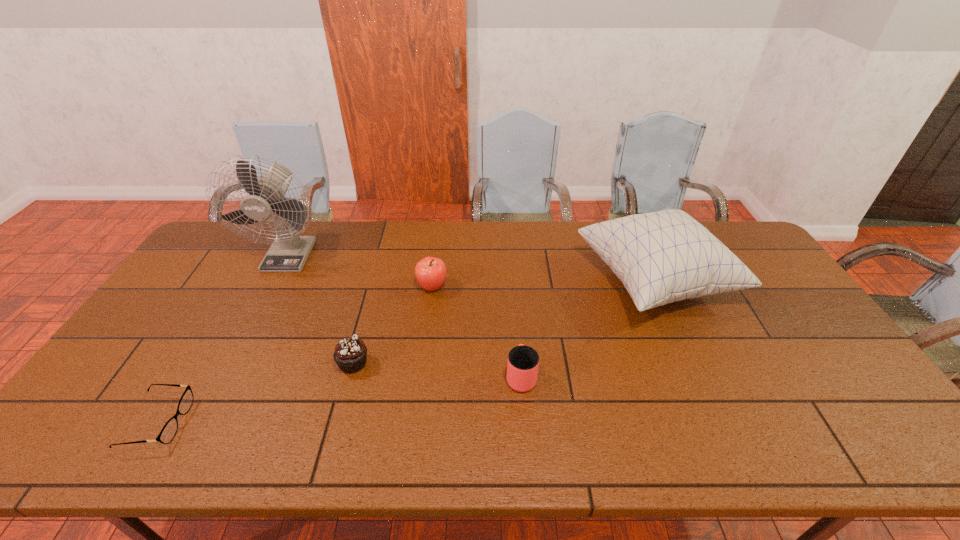
You are a GUI agent. You are given a task and a screenshot of the screen. Output one action in this format:
    pyautogui.click(x=<x>, y=<y>)
    Task: Click on the tallest object
    Image resolution: width=960 pixels, height=540 pixels.
    Given the screenshot: What is the action you would take?
    pyautogui.click(x=289, y=251)

Locate an element on the screen. The width and height of the screenshot is (960, 540). the rightmost object is located at coordinates (661, 257).

Locate an element on the screen. The width and height of the screenshot is (960, 540). cushion is located at coordinates (661, 257).

Find the location of `apple`. apple is located at coordinates (430, 272).

Image resolution: width=960 pixels, height=540 pixels. In order to click on the fourth object from left to right in this screenshot , I will do `click(430, 272)`.

Locate an element on the screen. The width and height of the screenshot is (960, 540). the fifth object from left to right is located at coordinates (523, 361).

Locate an element on the screen. This screenshot has width=960, height=540. cupcake is located at coordinates (350, 354).

The width and height of the screenshot is (960, 540). What are the coordinates of `spectacles` in the screenshot? It's located at (168, 432).

At what (x,y) coordinates should I click in order to perform the action: click on vacant space situated on the air flow direction of the tallest object. Please return your answer as a coordinate pair (x, y). Looking at the image, I should click on (240, 348).

The height and width of the screenshot is (540, 960). I want to click on vacant region located on the left of the cushion, so (x=499, y=282).